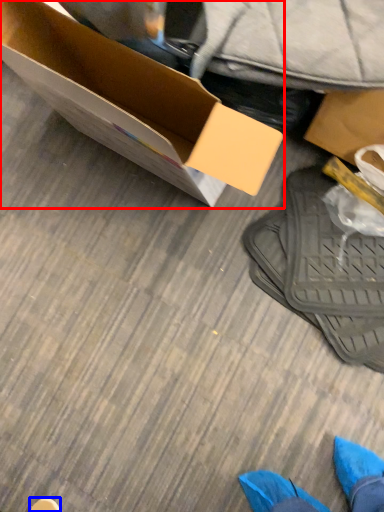
Question: Which object appears farthest to the camera in this image, box (highlighted by a red box) or shoe (highlighted by a blue box)?

Choices:
 (A) box
 (B) shoe

Answer: (B)